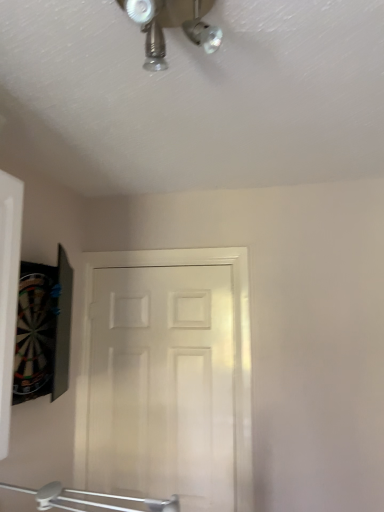
Identify the location of metallic chrome mechanical fan at upper center. (171, 26).

What do you see at coordinates (171, 26) in the screenshot? The height and width of the screenshot is (512, 384). I see `metallic chrome mechanical fan at upper center` at bounding box center [171, 26].

This screenshot has height=512, width=384. I want to click on white matte door at center, so click(167, 377).

Describe the element at coordinates (167, 377) in the screenshot. The image size is (384, 512). I see `white matte door at center` at that location.

Locate an element on the screen. Image resolution: width=384 pixels, height=512 pixels. metallic chrome mechanical fan at upper center is located at coordinates (x=171, y=26).

Does white matte door at center appear on the right side of metallic chrome mechanical fan at upper center?

Incorrect, white matte door at center is not on the right side of metallic chrome mechanical fan at upper center.

Which is in front, white matte door at center or metallic chrome mechanical fan at upper center?

Positioned in front is metallic chrome mechanical fan at upper center.

Does point (186, 335) come closer to viewer compared to point (163, 53)?

No, (186, 335) is further to viewer.

From the image's perspective, is white matte door at center positioned above or below metallic chrome mechanical fan at upper center?

Clearly, from the image's perspective, white matte door at center is below metallic chrome mechanical fan at upper center.

From a real-world perspective, which is physically above, white matte door at center or metallic chrome mechanical fan at upper center?

metallic chrome mechanical fan at upper center, from a real-world perspective.

Considering the sizes of objects white matte door at center and metallic chrome mechanical fan at upper center in the image provided, who is wider, white matte door at center or metallic chrome mechanical fan at upper center?

With larger width is metallic chrome mechanical fan at upper center.

Based on the photo, considering the sizes of white matte door at center and metallic chrome mechanical fan at upper center in the image, is white matte door at center taller or shorter than metallic chrome mechanical fan at upper center?

Considering their sizes, white matte door at center has more height than metallic chrome mechanical fan at upper center.

Is white matte door at center bigger or smaller than metallic chrome mechanical fan at upper center?

In the image, white matte door at center appears to be larger than metallic chrome mechanical fan at upper center.

Could metallic chrome mechanical fan at upper center be considered to be inside white matte door at center?

Actually, metallic chrome mechanical fan at upper center is outside white matte door at center.

Is white matte door at center placed right next to metallic chrome mechanical fan at upper center?

They are not placed beside each other.

Looking at this image, does white matte door at center turn towards metallic chrome mechanical fan at upper center?

Yes, white matte door at center is oriented towards metallic chrome mechanical fan at upper center.

How distant is white matte door at center from metallic chrome mechanical fan at upper center?

white matte door at center is 1.43 meters away from metallic chrome mechanical fan at upper center.

The image size is (384, 512). I want to click on mechanical fan above the white matte door at center (from a real-world perspective), so click(x=171, y=26).

Is metallic chrome mechanical fan at upper center to the right of white matte door at center from the viewer's perspective?

Correct, you'll find metallic chrome mechanical fan at upper center to the right of white matte door at center.

Which object is closer to the camera, metallic chrome mechanical fan at upper center or white matte door at center?

metallic chrome mechanical fan at upper center is more forward.

Between point (162, 47) and point (241, 290), which one is positioned behind?

The point (241, 290) is more distant.

From the image's perspective, between metallic chrome mechanical fan at upper center and white matte door at center, who is located below?

From the image's view, white matte door at center is below.

From a real-world perspective, which is physically above, metallic chrome mechanical fan at upper center or white matte door at center?

metallic chrome mechanical fan at upper center.

In terms of width, does metallic chrome mechanical fan at upper center look wider or thinner when compared to white matte door at center?

In the image, metallic chrome mechanical fan at upper center appears to be wider than white matte door at center.

In terms of height, does metallic chrome mechanical fan at upper center look taller or shorter compared to white matte door at center?

metallic chrome mechanical fan at upper center is shorter than white matte door at center.

Which of these two, metallic chrome mechanical fan at upper center or white matte door at center, is bigger?

Bigger between the two is white matte door at center.

Is white matte door at center located within metallic chrome mechanical fan at upper center?

Definitely not — white matte door at center is not inside metallic chrome mechanical fan at upper center.

Can you see metallic chrome mechanical fan at upper center touching white matte door at center?

metallic chrome mechanical fan at upper center and white matte door at center are not in contact.

Is metallic chrome mechanical fan at upper center looking in the opposite direction of white matte door at center?

metallic chrome mechanical fan at upper center is not turned away from white matte door at center.

How many degrees apart are the facing directions of metallic chrome mechanical fan at upper center and white matte door at center?

92.7 degrees.

Find the location of a particular element. mechanical fan in front of the white matte door at center is located at coordinates (171, 26).

Locate an element on the screen. mechanical fan in front of the white matte door at center is located at coordinates (171, 26).

Locate an element on the screen. The height and width of the screenshot is (512, 384). door on the left side of metallic chrome mechanical fan at upper center is located at coordinates (167, 377).